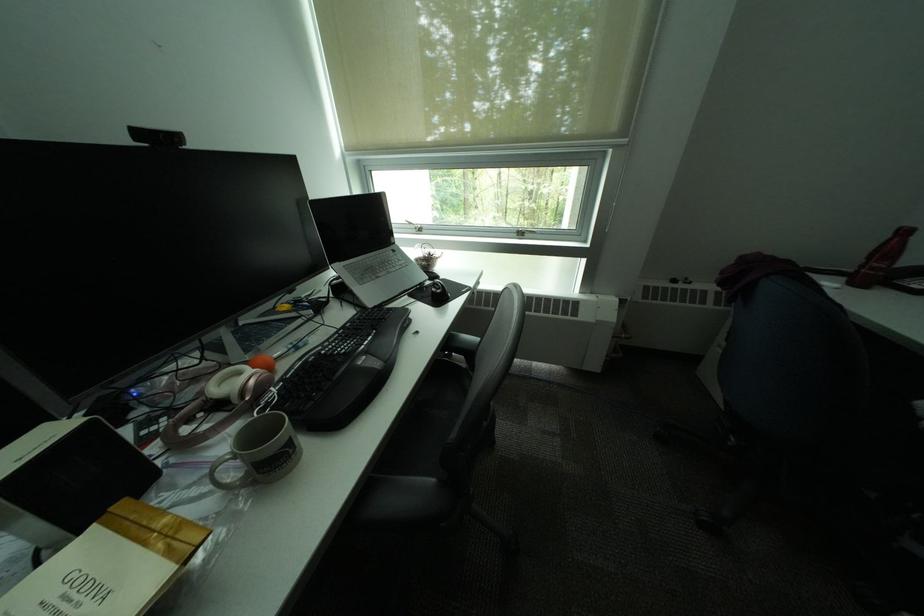
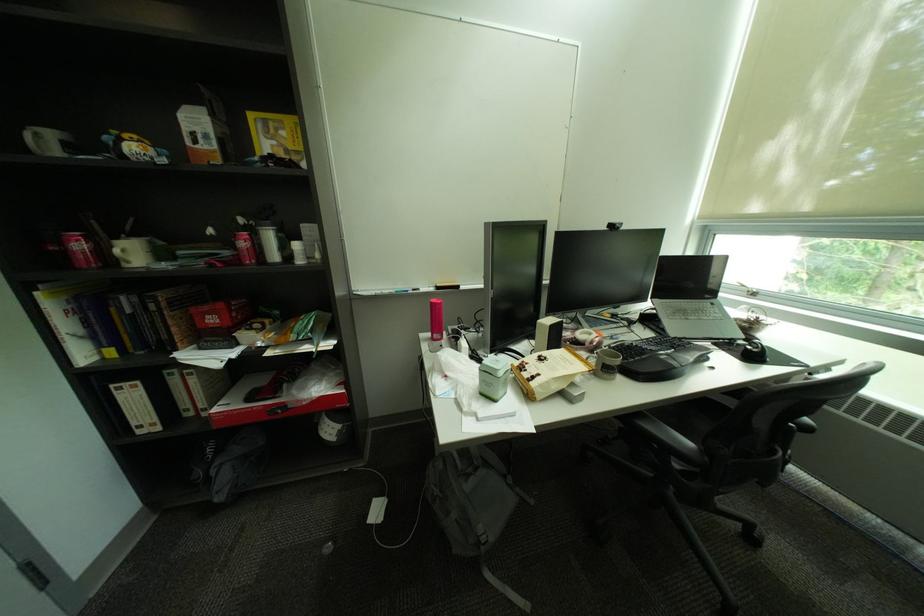
Find the pixel in the second image that matches (271,475) in the first image.

(613, 371)